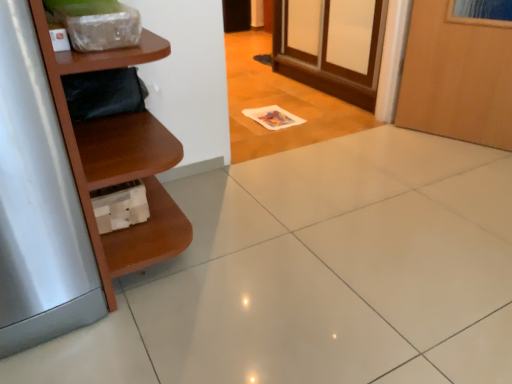
Find the location of `vacant space to the right of brushed metal refrigerator at left`. vacant space to the right of brushed metal refrigerator at left is located at coordinates (218, 275).